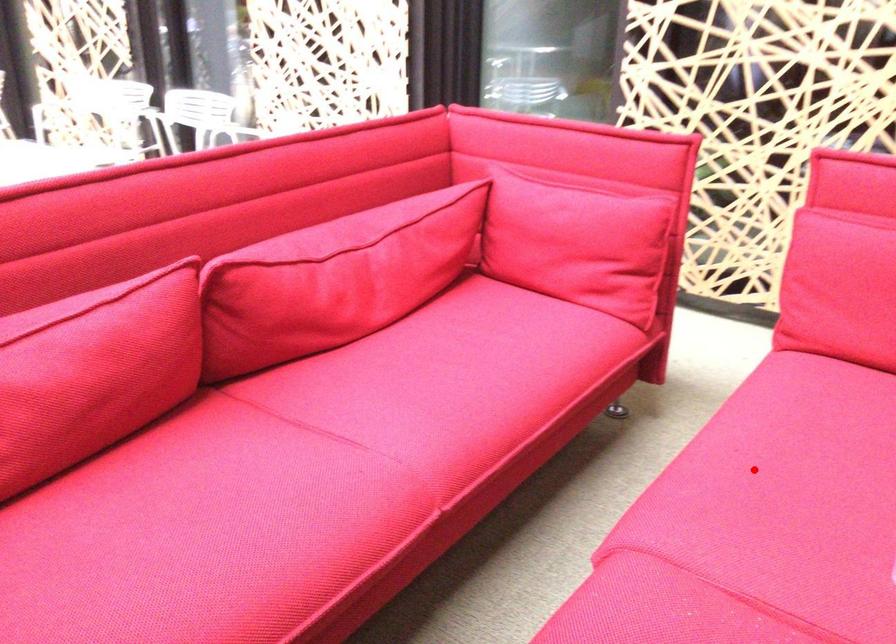
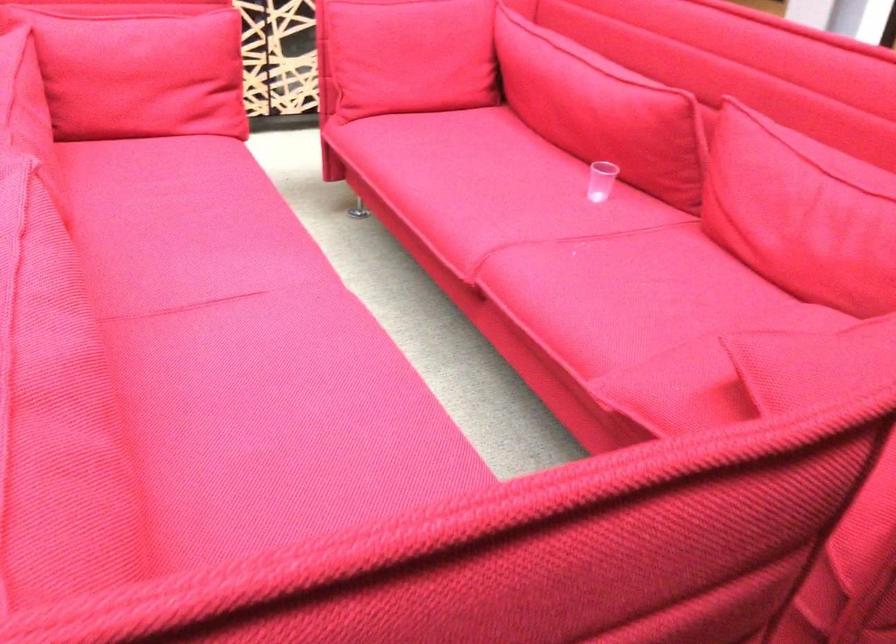
Locate, in the second image, the point that corresponds to the highlighted location in the first image.

(488, 192)